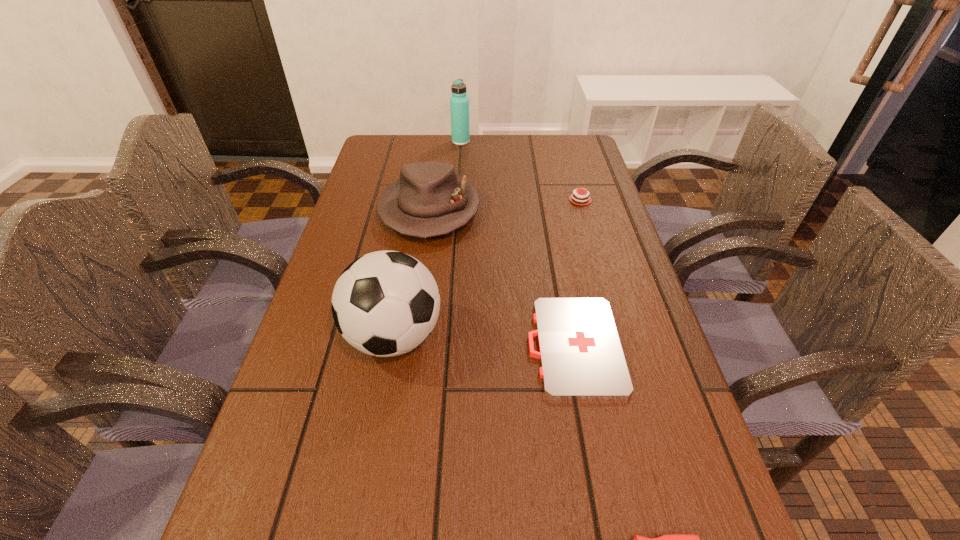
Locate an element on the screen. This screenshot has height=540, width=960. free space at the far left corner of the desktop is located at coordinates (417, 138).

In the image, there is a desktop. Identify the location of free space at the far right corner. (549, 168).

I want to click on unoccupied area between the third tallest object and the shortest object, so click(502, 278).

The width and height of the screenshot is (960, 540). I want to click on vacant area that lies between the first-aid kit and the soccer ball, so click(x=484, y=341).

Where is `vacant region between the chocolate cake and the hat`? The height and width of the screenshot is (540, 960). vacant region between the chocolate cake and the hat is located at coordinates (505, 205).

Where is `unoccupied area between the chocolate cake and the farthest object`? This screenshot has width=960, height=540. unoccupied area between the chocolate cake and the farthest object is located at coordinates (520, 171).

At what (x,y) coordinates should I click in order to perform the action: click on free space between the hat and the first-aid kit. Please return your answer as a coordinate pair (x, y). This screenshot has height=540, width=960. Looking at the image, I should click on [502, 278].

The image size is (960, 540). Find the location of `empty space between the fourth shortest object and the first-aid kit`. empty space between the fourth shortest object and the first-aid kit is located at coordinates (502, 278).

Choose which object is the nearest neighbor to the nearest object. Please provide its 2D coordinates. Your answer should be formatted as a tuple, i.e. [(x, y)], where the tuple contains the x and y coordinates of a point satisfying the conditions above.

[(581, 356)]

Identify the location of object that is the fourth closest to the thermos bottle. The height and width of the screenshot is (540, 960). (581, 356).